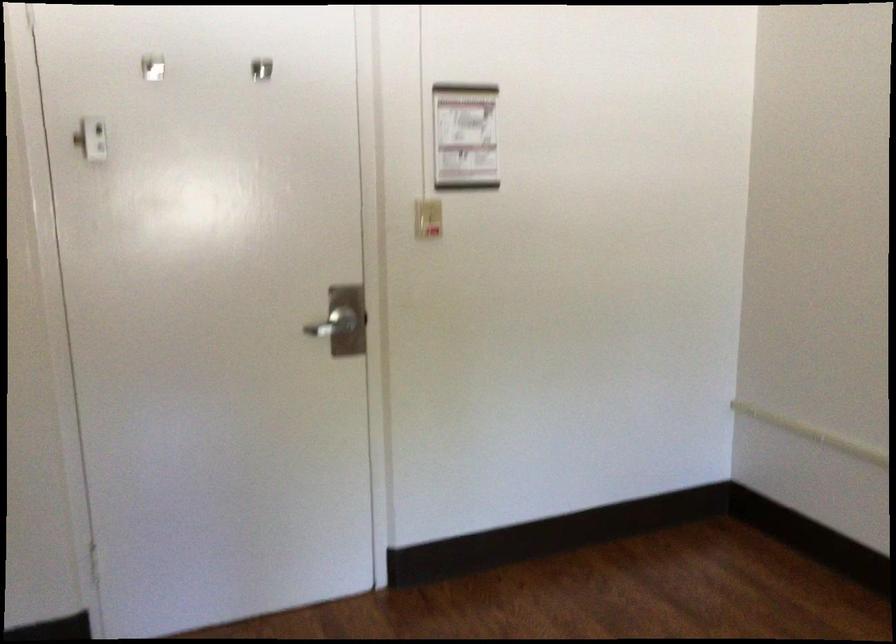
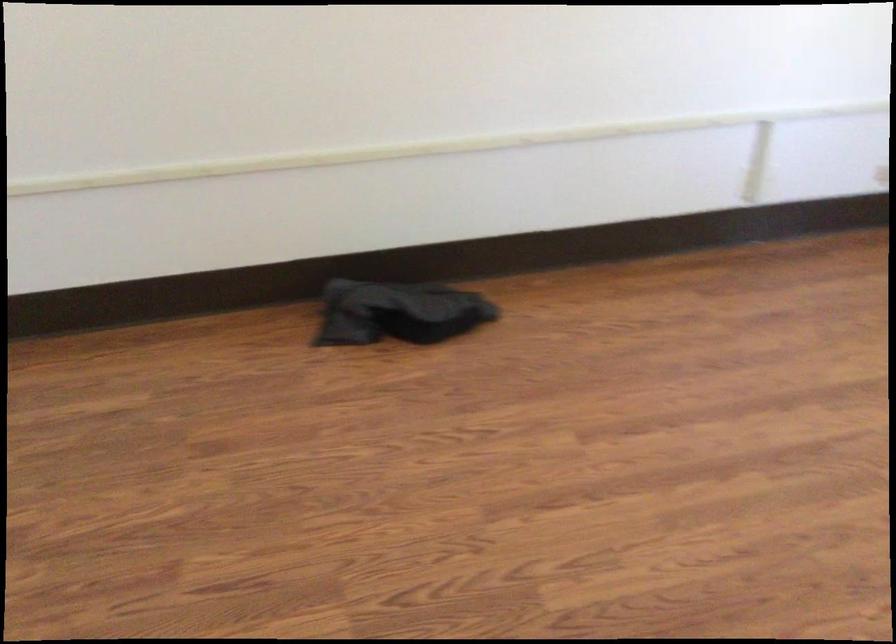
The images are taken continuously from a first-person perspective. In which direction is your viewpoint rotating?

The camera's rotation is toward right-down.